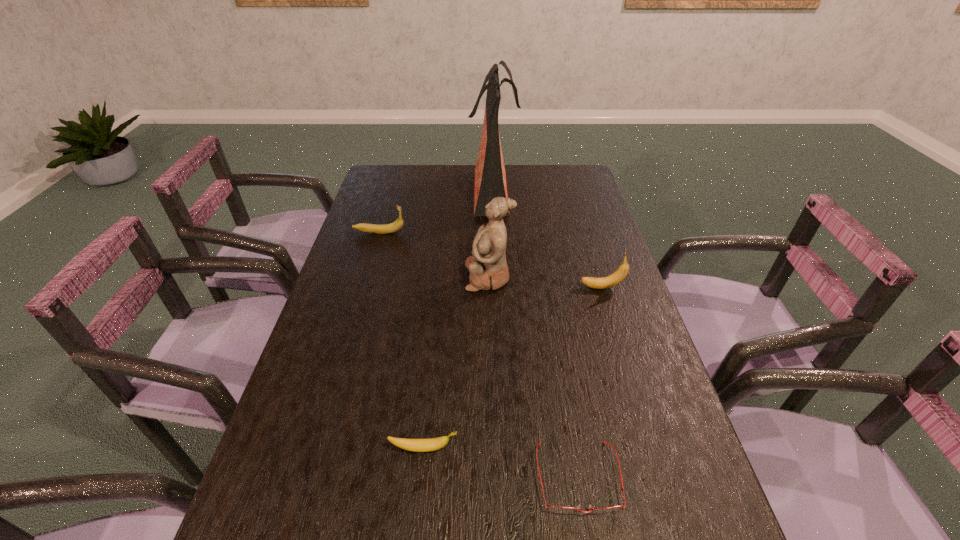
Image resolution: width=960 pixels, height=540 pixels. I want to click on free space located at the stem of the shortest banana, so (498, 448).

Find the location of `object that is at the far edge`. object that is at the far edge is located at coordinates (490, 177).

Locate an element on the screen. The image size is (960, 540). object at the left edge is located at coordinates (398, 224).

Locate an element on the screen. The width and height of the screenshot is (960, 540). banana that is at the right edge is located at coordinates (606, 282).

This screenshot has width=960, height=540. Identify the location of spectacles at the right edge. (557, 509).

I want to click on free space at the far edge of the desktop, so click(431, 184).

Where is `free space at the left edge of the desktop`? free space at the left edge of the desktop is located at coordinates (379, 280).

The height and width of the screenshot is (540, 960). What are the coordinates of `free space at the right edge of the desktop` in the screenshot? It's located at (607, 299).

Locate an element on the screen. The width and height of the screenshot is (960, 540). free location at the far left corner of the desktop is located at coordinates (409, 179).

Identify the location of vacant space that's between the tallest object and the farthest banana. The width and height of the screenshot is (960, 540). (436, 211).